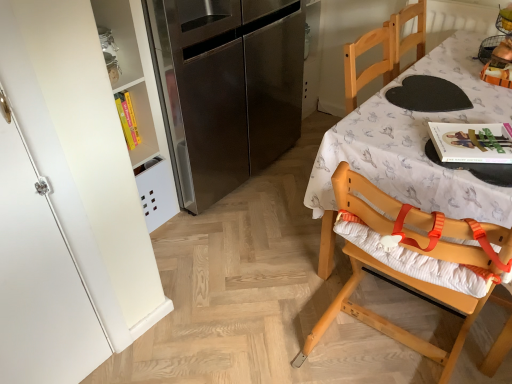
Find the location of `wooden highchair at right`. wooden highchair at right is located at coordinates (414, 251).

The width and height of the screenshot is (512, 384). I want to click on stainless steel refrigerator at left, so click(x=228, y=88).

Identify the location of wooden highchair at right. This screenshot has height=384, width=512. (414, 251).

Is the position of stainless steel refrigerator at left more distant than that of wooden highchair at right?

Yes, it is.

I want to click on refrigerator behind the wooden highchair at right, so click(x=228, y=88).

Is stainless steel refrigerator at left looking in the opposite direction of wooden highchair at right?

No, stainless steel refrigerator at left is not facing away from wooden highchair at right.

Is white matte cabinet at left in contact with stainless steel refrigerator at left?

white matte cabinet at left is not next to stainless steel refrigerator at left, and they're not touching.

Does point (86, 76) come in front of point (185, 57)?

Yes, point (86, 76) is closer to viewer.

In terms of width, does white matte cabinet at left look wider or thinner when compared to stainless steel refrigerator at left?

white matte cabinet at left is thinner than stainless steel refrigerator at left.

Between white matte cabinet at left and stainless steel refrigerator at left, which one is positioned in front?

white matte cabinet at left is closer to the camera.

Are white matte cabinet at left and wooden highchair at right making contact?

No, white matte cabinet at left is not beside wooden highchair at right.

Could you tell me if white matte cabinet at left is facing wooden highchair at right?

No, white matte cabinet at left is not aimed at wooden highchair at right.

From a real-world perspective, is white matte cabinet at left on wooden highchair at right?

Correct, in the physical world, white matte cabinet at left is higher than wooden highchair at right.

The image size is (512, 384). Find the location of `chair on the right of stainless steel refrigerator at left`. chair on the right of stainless steel refrigerator at left is located at coordinates (414, 251).

Is point (370, 200) positioned before point (230, 142)?

Yes, it is.

Would you say wooden highchair at right is inside or outside stainless steel refrigerator at left?

wooden highchair at right is not inside stainless steel refrigerator at left, it's outside.

Considering the sizes of objects stainless steel refrigerator at left and white matte cabinet at left in the image provided, who is thinner, stainless steel refrigerator at left or white matte cabinet at left?

white matte cabinet at left.

Which object is positioned more to the left, stainless steel refrigerator at left or white matte cabinet at left?

Positioned to the left is white matte cabinet at left.

From the image's perspective, which is above, stainless steel refrigerator at left or white matte cabinet at left?

stainless steel refrigerator at left, from the image's perspective.

From a real-world perspective, is stainless steel refrigerator at left physically below white matte cabinet at left?

No, from a real-world perspective, stainless steel refrigerator at left is not under white matte cabinet at left.

Which object is wider, white matte cabinet at left or wooden chair at right?

With larger width is wooden chair at right.

Is white matte cabinet at left in front of wooden chair at right?

Yes, it is.

Looking at this image, is white matte cabinet at left oriented away from wooden chair at right?

No, wooden chair at right is not at the back of white matte cabinet at left.

Are white matte cabinet at left and wooden chair at right located far from each other?

No, there isn't a large distance between white matte cabinet at left and wooden chair at right.

Based on the photo, does wooden highchair at right contain white matte cabinet at left?

No, white matte cabinet at left is not a part of wooden highchair at right.

From the image's perspective, is wooden highchair at right above or below white matte cabinet at left?

From the image's perspective, wooden highchair at right appears above white matte cabinet at left.

From a real-world perspective, is wooden highchair at right positioned under white matte cabinet at left based on gravity?

Yes, from a real-world perspective, wooden highchair at right is beneath white matte cabinet at left.

Does wooden highchair at right have a greater height compared to white matte cabinet at left?

In fact, wooden highchair at right may be shorter than white matte cabinet at left.

Where is `refrigerator above the wooden highchair at right (from the image's perspective)`? This screenshot has height=384, width=512. refrigerator above the wooden highchair at right (from the image's perspective) is located at coordinates (228, 88).

You are a GUI agent. You are given a task and a screenshot of the screen. Output one action in this format:
    pyautogui.click(x=<x>, y=<y>)
    Task: Click on the refrigerator that is behind the white matte cabinet at left
    Image resolution: width=512 pixels, height=384 pixels.
    Given the screenshot: What is the action you would take?
    pyautogui.click(x=228, y=88)

Looking at the image, which one is located closer to wooden chair at right, wooden highchair at right or stainless steel refrigerator at left?

Based on the image, wooden highchair at right appears to be nearer to wooden chair at right.

Which object lies nearer to the anchor point wooden highchair at right, wooden chair at right or white matte cabinet at left?

Based on the image, wooden chair at right appears to be nearer to wooden highchair at right.

Estimate the real-world distances between objects in this image. Which object is closer to white matte cabinet at left, stainless steel refrigerator at left or wooden chair at right?

stainless steel refrigerator at left is closer to white matte cabinet at left.

Which object lies further to the anchor point white matte cabinet at left, wooden chair at right or stainless steel refrigerator at left?

The object further to white matte cabinet at left is wooden chair at right.

Which object lies further to the anchor point stainless steel refrigerator at left, white matte cabinet at left or wooden chair at right?

white matte cabinet at left is positioned further to the anchor stainless steel refrigerator at left.

Looking at this image, from the image, which object appears to be farther from white matte cabinet at left, wooden chair at right or wooden highchair at right?

wooden chair at right lies further to white matte cabinet at left than the other object.

Looking at this image, considering their positions, is wooden highchair at right positioned further to wooden chair at right than white matte cabinet at left?

The object further to wooden chair at right is white matte cabinet at left.

Looking at this image, when comparing their distances from stainless steel refrigerator at left, does white matte cabinet at left or wooden highchair at right seem closer?

white matte cabinet at left.

Identify the location of refrigerator between white matte cabinet at left and wooden highchair at right in the horizontal direction. (228, 88).

Locate an element on the screen. refrigerator located between white matte cabinet at left and wooden chair at right in the left-right direction is located at coordinates (228, 88).

Identify the location of chair located between white matte cabinet at left and wooden chair at right in the left-right direction. (414, 251).

Find the location of a particular element. The image size is (512, 384). chair between stainless steel refrigerator at left and wooden chair at right from left to right is located at coordinates (414, 251).